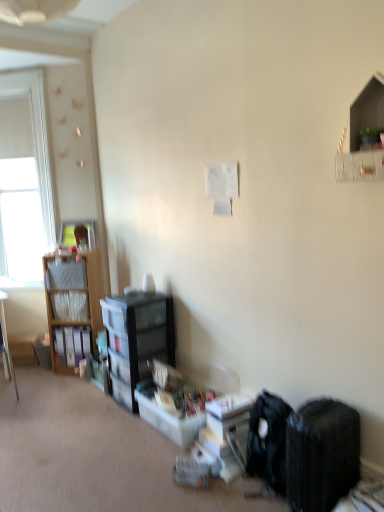
Question: Considering the relative positions of matte wooden picture frame at upper left and translucent plastic storage box at lower center in the image provided, is matte wooden picture frame at upper left to the right of translucent plastic storage box at lower center from the viewer's perspective?

Choices:
 (A) yes
 (B) no

Answer: (B)

Question: Are matte wooden picture frame at upper left and translucent plastic storage box at lower center making contact?

Choices:
 (A) no
 (B) yes

Answer: (A)

Question: From a real-world perspective, is matte wooden picture frame at upper left located higher than translucent plastic storage box at lower center?

Choices:
 (A) yes
 (B) no

Answer: (A)

Question: Considering the relative sizes of matte wooden picture frame at upper left and translucent plastic storage box at lower center in the image provided, is matte wooden picture frame at upper left bigger than translucent plastic storage box at lower center?

Choices:
 (A) no
 (B) yes

Answer: (A)

Question: Is matte wooden picture frame at upper left at the left side of translucent plastic storage box at lower center?

Choices:
 (A) no
 (B) yes

Answer: (B)

Question: Is matte wooden picture frame at upper left turned away from translucent plastic storage box at lower center?

Choices:
 (A) no
 (B) yes

Answer: (A)

Question: Does matte wood desk at left have a lesser height compared to white matte window screen at left?

Choices:
 (A) no
 (B) yes

Answer: (B)

Question: Considering the relative positions of matte wood desk at left and white matte window screen at left in the image provided, is matte wood desk at left to the right of white matte window screen at left from the viewer's perspective?

Choices:
 (A) yes
 (B) no

Answer: (A)

Question: Does matte wood desk at left have a smaller size compared to white matte window screen at left?

Choices:
 (A) no
 (B) yes

Answer: (B)

Question: Considering the relative sizes of matte wood desk at left and white matte window screen at left in the image provided, is matte wood desk at left wider than white matte window screen at left?

Choices:
 (A) yes
 (B) no

Answer: (A)

Question: Does matte wood desk at left have a lesser width compared to white matte window screen at left?

Choices:
 (A) yes
 (B) no

Answer: (B)

Question: Is matte wood desk at left aimed at white matte window screen at left?

Choices:
 (A) yes
 (B) no

Answer: (B)

Question: Is black plastic bookcase at center-left directly adjacent to white glossy shelf at upper right, placed as the first shelf when sorted from top to bottom?

Choices:
 (A) yes
 (B) no

Answer: (B)